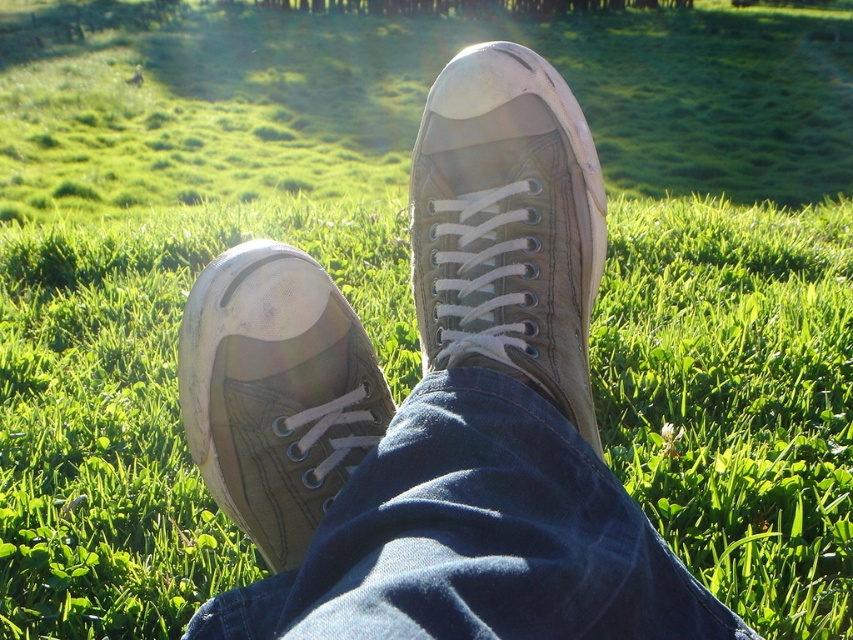
Question: Does worn canvas shoe at center have a greater width compared to matte brown shoe at lower left?

Choices:
 (A) yes
 (B) no

Answer: (A)

Question: Which point is closer to the camera?

Choices:
 (A) canvas sneakers at center
 (B) worn canvas shoe at center

Answer: (A)

Question: Does canvas sneakers at center have a smaller size compared to matte brown shoe at lower left?

Choices:
 (A) yes
 (B) no

Answer: (B)

Question: Which point appears farthest from the camera in this image?

Choices:
 (A) (544, 388)
 (B) (212, 448)

Answer: (B)

Question: Can you confirm if canvas sneakers at center is bigger than matte brown shoe at lower left?

Choices:
 (A) no
 (B) yes

Answer: (B)

Question: Among these objects, which one is nearest to the camera?

Choices:
 (A) canvas sneakers at center
 (B) worn canvas shoe at center
 (C) matte brown shoe at lower left

Answer: (A)